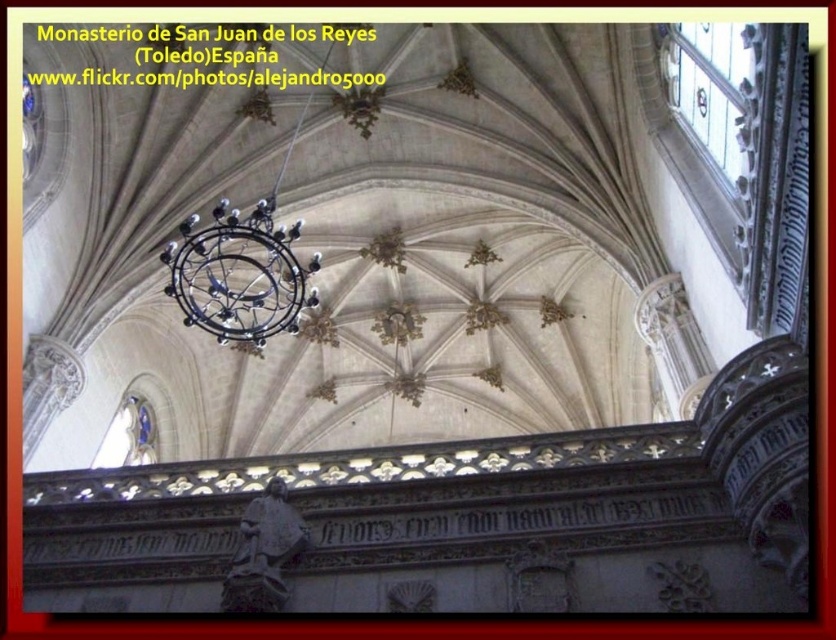
You are an interior designer planning to install a new lighting fixture that requires a minimum of 90 feet of clearance from any existing fixtures. Given the current setup with the black wrought iron chandelier at center and the dark gray stone statue at lower center, will the proposed installation meet the clearance requirement?

The distance between the black wrought iron chandelier at center and the dark gray stone statue at lower center is 100.57 feet, which exceeds the required 90 feet clearance. Therefore, the installation meets the clearance requirement.